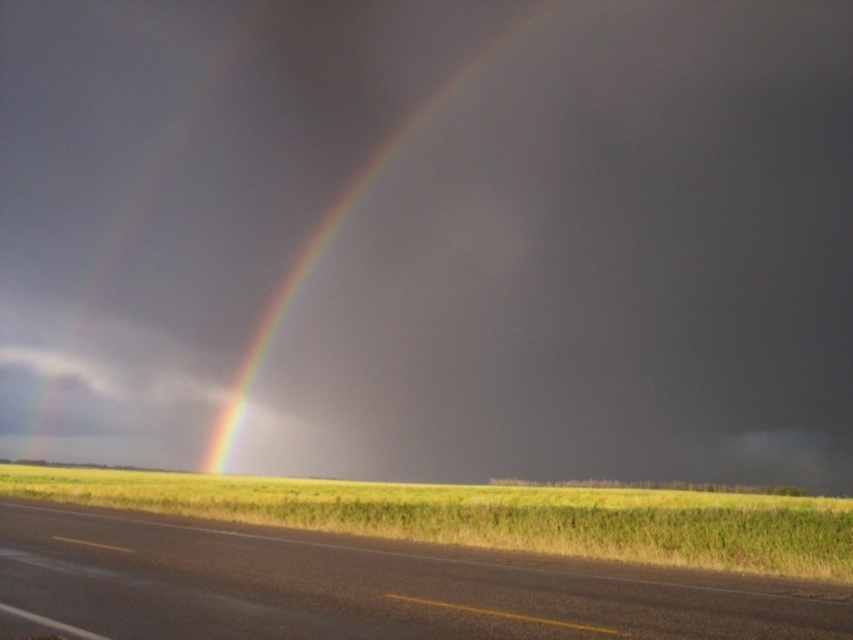
Who is positioned more to the right, asphalt road at lower center or glossy rainbow at center?

From the viewer's perspective, asphalt road at lower center appears more on the right side.

How much distance is there between asphalt road at lower center and glossy rainbow at center?

82.93 meters

Does point (496, 568) come in front of point (273, 326)?

Yes, it is in front of point (273, 326).

This screenshot has height=640, width=853. In order to click on asphalt road at lower center in this screenshot , I will do `click(363, 588)`.